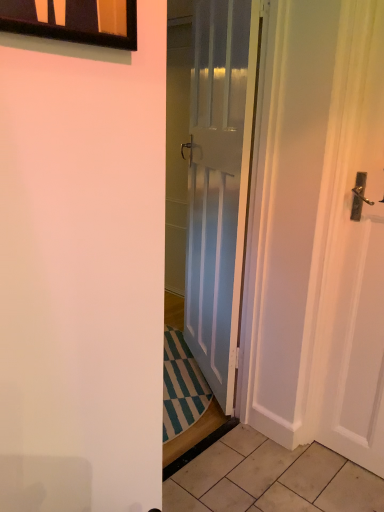
Question: From the image's perspective, is beige tile at lower right on top of black glass window at upper left?

Choices:
 (A) no
 (B) yes

Answer: (A)

Question: Is beige tile at lower right wider than black glass window at upper left?

Choices:
 (A) no
 (B) yes

Answer: (B)

Question: Can you confirm if beige tile at lower right is shorter than black glass window at upper left?

Choices:
 (A) yes
 (B) no

Answer: (A)

Question: From the image's perspective, is beige tile at lower right beneath black glass window at upper left?

Choices:
 (A) yes
 (B) no

Answer: (A)

Question: Is beige tile at lower right to the right of black glass window at upper left from the viewer's perspective?

Choices:
 (A) no
 (B) yes

Answer: (B)

Question: Can you confirm if beige tile at lower right is taller than black glass window at upper left?

Choices:
 (A) no
 (B) yes

Answer: (A)

Question: From the image's perspective, is beige tile at lower right on white glossy door at center?

Choices:
 (A) no
 (B) yes

Answer: (A)

Question: Does beige tile at lower right appear on the right side of white glossy door at center?

Choices:
 (A) no
 (B) yes

Answer: (B)

Question: Considering the relative sizes of beige tile at lower right and white glossy door at center in the image provided, is beige tile at lower right shorter than white glossy door at center?

Choices:
 (A) yes
 (B) no

Answer: (A)

Question: Is beige tile at lower right wider than white glossy door at center?

Choices:
 (A) yes
 (B) no

Answer: (A)

Question: Considering the relative sizes of beige tile at lower right and white glossy door at center in the image provided, is beige tile at lower right taller than white glossy door at center?

Choices:
 (A) no
 (B) yes

Answer: (A)

Question: Is beige tile at lower right smaller than white glossy door at center?

Choices:
 (A) no
 (B) yes

Answer: (B)

Question: From a real-world perspective, is black glass window at upper left physically above beige tile at lower right?

Choices:
 (A) yes
 (B) no

Answer: (A)